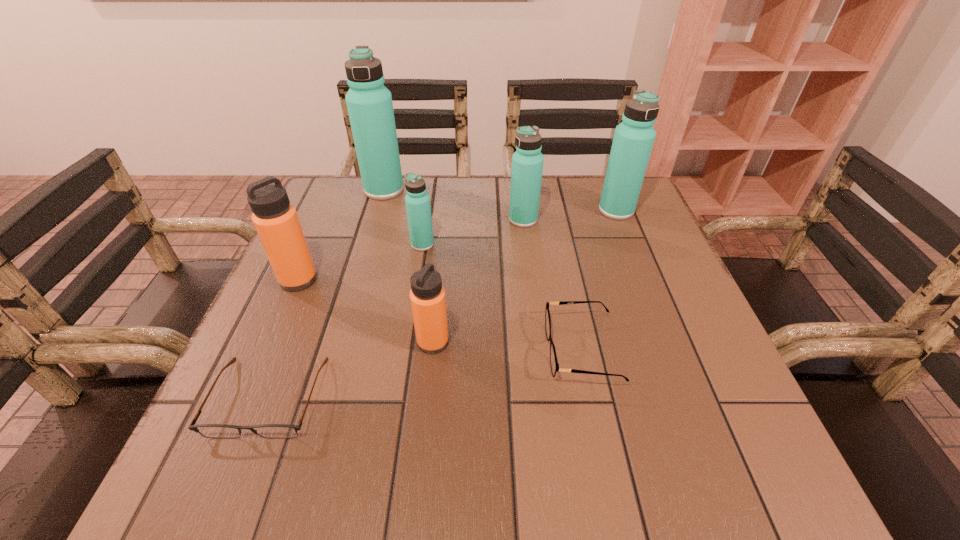
Select which thermos bottle is the fourth closest to the second nearest thermos bottle. Please provide its 2D coordinates. Your answer should be formatted as a tuple, i.e. [(x, y)], where the tuple contains the x and y coordinates of a point satisfying the conditions above.

[(527, 162)]

Identify which aqua thermos bottle is the third nearest to the shorter spectacles. Please provide its 2D coordinates. Your answer should be formatted as a tuple, i.e. [(x, y)], where the tuple contains the x and y coordinates of a point satisfying the conditions above.

[(527, 162)]

Locate an element on the screen. This screenshot has height=540, width=960. aqua thermos bottle that is the second closest to the second aqua thermos bottle from left to right is located at coordinates (527, 162).

Image resolution: width=960 pixels, height=540 pixels. Find the location of `vacant space that satisfies the following two spatial constraints: 1. on the front side of the fifth farthest object; 2. on the left side of the smaller orange thermos bottle`. vacant space that satisfies the following two spatial constraints: 1. on the front side of the fifth farthest object; 2. on the left side of the smaller orange thermos bottle is located at coordinates (271, 342).

Find the location of a particular element. The image size is (960, 540). vacant space that satisfies the following two spatial constraints: 1. on the front side of the smaller orange thermos bottle; 2. on the left side of the farthest thermos bottle is located at coordinates (339, 342).

Identify the location of vacant space that satisfies the following two spatial constraints: 1. on the back side of the rightmost aqua thermos bottle; 2. on the left side of the third biggest aqua thermos bottle. This screenshot has width=960, height=540. (522, 211).